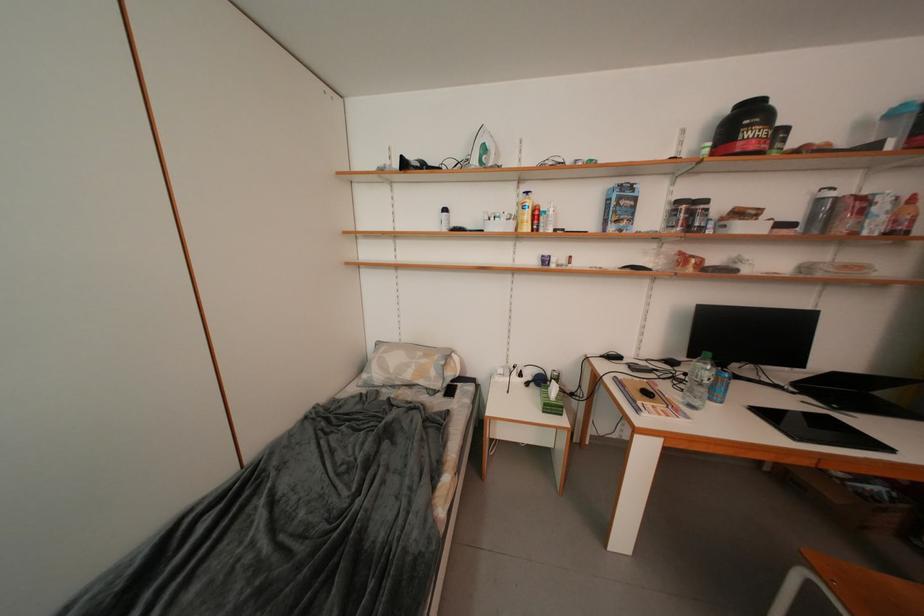
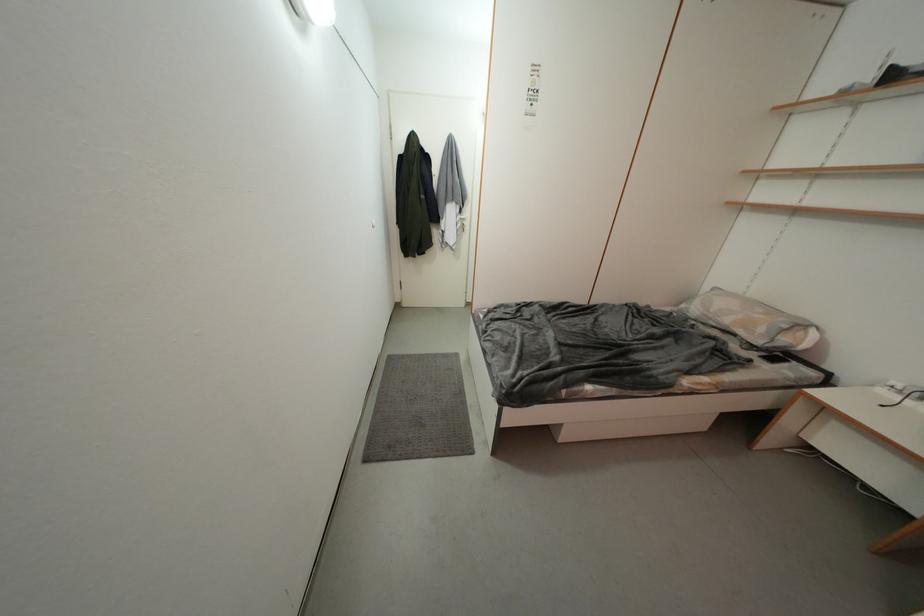
Find the pixel in the second image that matches (441,376) in the first image.

(769, 333)